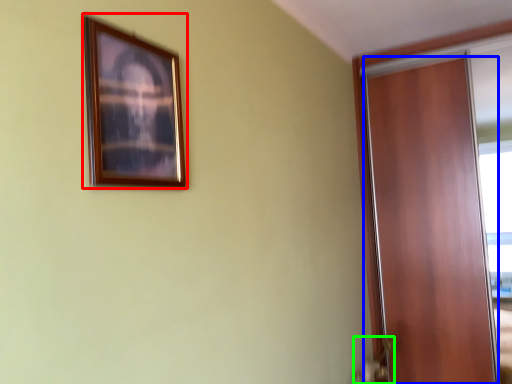
Question: Which object is the farthest from picture frame (highlighted by a red box)? Choose among these: door (highlighted by a blue box) or door handle (highlighted by a green box).

Choices:
 (A) door
 (B) door handle

Answer: (A)